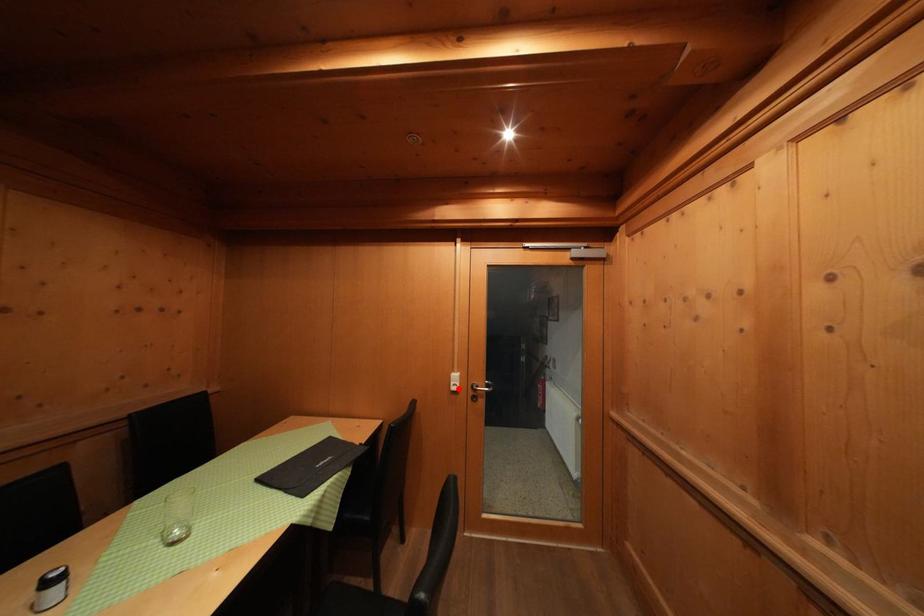
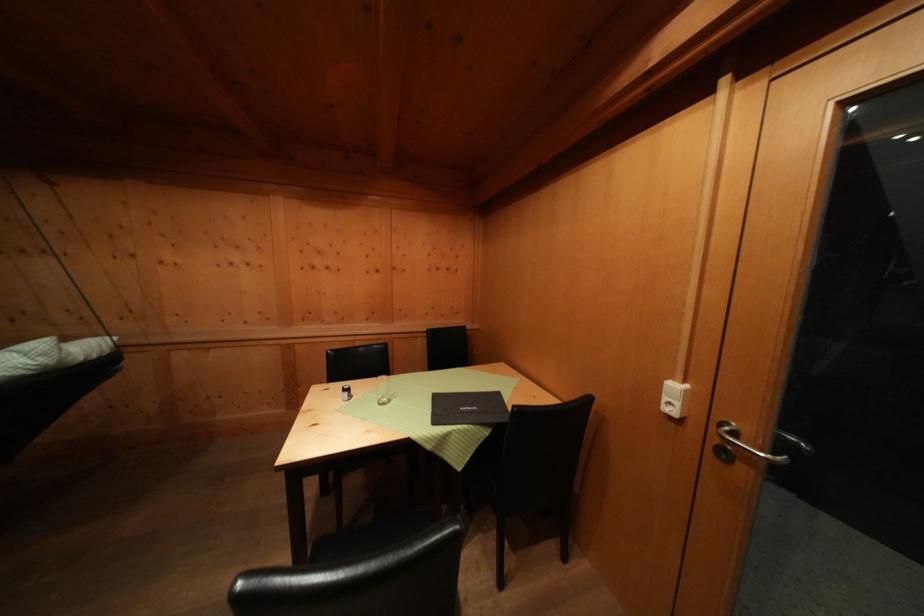
Locate, in the second image, the point that corresponds to the highlighted location in the first image.

(672, 403)